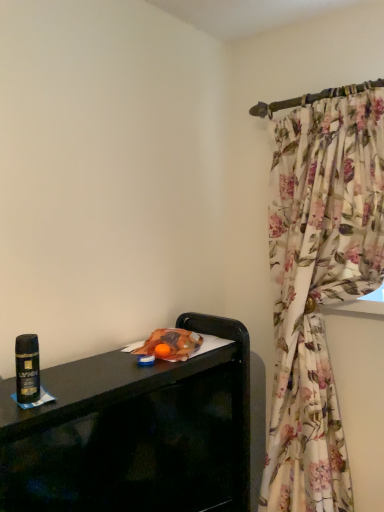
Question: Is black glossy tv stand at lower left inside shiny black can at left?

Choices:
 (A) no
 (B) yes

Answer: (A)

Question: From the image's perspective, is shiny black can at left beneath black glossy tv stand at lower left?

Choices:
 (A) no
 (B) yes

Answer: (A)

Question: Is shiny black can at left wider than black glossy tv stand at lower left?

Choices:
 (A) no
 (B) yes

Answer: (A)

Question: Could you tell me if shiny black can at left is facing black glossy tv stand at lower left?

Choices:
 (A) no
 (B) yes

Answer: (A)

Question: Is shiny black can at left not close to black glossy tv stand at lower left?

Choices:
 (A) yes
 (B) no

Answer: (B)

Question: Does shiny black can at left lie behind black glossy tv stand at lower left?

Choices:
 (A) yes
 (B) no

Answer: (B)

Question: From a real-world perspective, is black glossy tv stand at lower left on top of shiny black can at left?

Choices:
 (A) no
 (B) yes

Answer: (A)

Question: Does black glossy tv stand at lower left have a larger size compared to shiny black can at left?

Choices:
 (A) no
 (B) yes

Answer: (B)

Question: Considering the relative sizes of black glossy tv stand at lower left and shiny black can at left in the image provided, is black glossy tv stand at lower left smaller than shiny black can at left?

Choices:
 (A) no
 (B) yes

Answer: (A)

Question: Considering the relative sizes of black glossy tv stand at lower left and shiny black can at left in the image provided, is black glossy tv stand at lower left shorter than shiny black can at left?

Choices:
 (A) yes
 (B) no

Answer: (B)

Question: Is black glossy tv stand at lower left closer to the viewer compared to shiny black can at left?

Choices:
 (A) yes
 (B) no

Answer: (B)

Question: Does black glossy tv stand at lower left have a lesser width compared to shiny black can at left?

Choices:
 (A) no
 (B) yes

Answer: (A)

Question: Relative to shiny black can at left, is black glossy tv stand at lower left in front or behind?

Choices:
 (A) behind
 (B) front

Answer: (A)